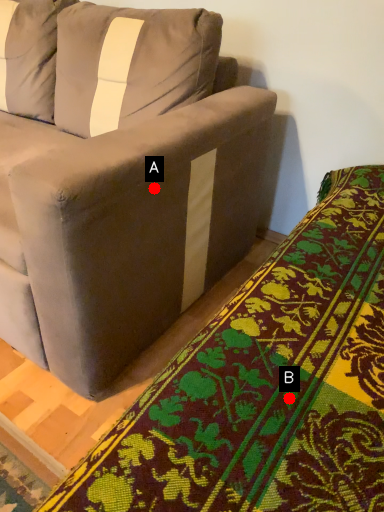
Question: Two points are circled on the image, labeled by A and B beside each circle. Which point appears farthest from the camera in this image?

Choices:
 (A) A is further
 (B) B is further

Answer: (A)